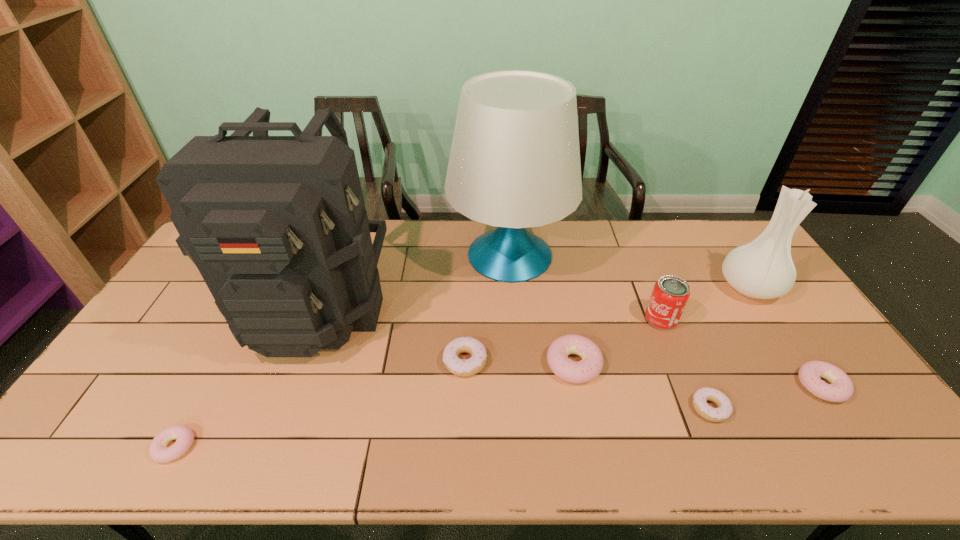
This screenshot has width=960, height=540. I want to click on the second biggest pink doughnut, so click(841, 388).

I want to click on the rightmost pink doughnut, so click(x=841, y=388).

The width and height of the screenshot is (960, 540). Identify the location of the smaller white doughnut. (725, 408).

The height and width of the screenshot is (540, 960). I want to click on the right white doughnut, so click(x=725, y=408).

The width and height of the screenshot is (960, 540). Identify the location of the leftmost doughnut. (158, 450).

Where is `the leftmost pink doughnut`? The height and width of the screenshot is (540, 960). the leftmost pink doughnut is located at coordinates (158, 450).

Locate an element on the screen. This screenshot has width=960, height=540. vacant area located 0.220m on the front-facing side of the table lamp is located at coordinates (386, 255).

Locate an element on the screen. vacant space located 0.250m on the front-facing side of the table lamp is located at coordinates (377, 255).

Find the location of `vacant area located 0.380m on the front-facing side of the table lamp`. vacant area located 0.380m on the front-facing side of the table lamp is located at coordinates (340, 255).

Locate an element on the screen. free space located on the front compartment of the gray backpack is located at coordinates pyautogui.click(x=257, y=460).